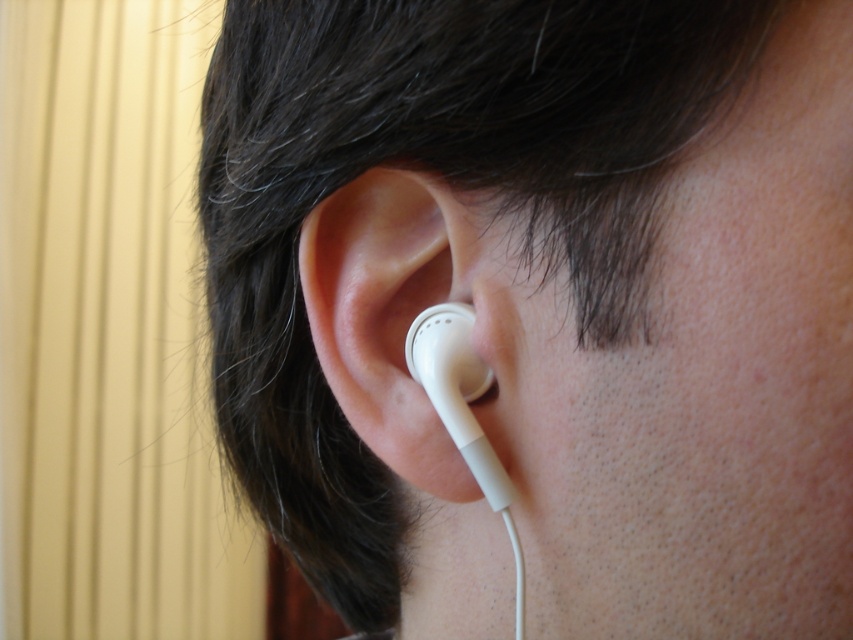
Question: Can you confirm if white matte earbud at center is smaller than white matte earbud at ear?

Choices:
 (A) no
 (B) yes

Answer: (A)

Question: Does white matte earbud at center have a lesser width compared to white matte earbud at ear?

Choices:
 (A) yes
 (B) no

Answer: (B)

Question: Which point is closer to the camera?

Choices:
 (A) coord(413,362)
 (B) coord(306,240)

Answer: (A)

Question: Which point is closer to the camera taking this photo?

Choices:
 (A) [352, 236]
 (B) [479, 465]

Answer: (B)

Question: Is white matte earbud at center bigger than white matte earbud at ear?

Choices:
 (A) no
 (B) yes

Answer: (B)

Question: Which object is farther from the camera taking this photo?

Choices:
 (A) white matte earbud at ear
 (B) white matte earbud at center

Answer: (A)